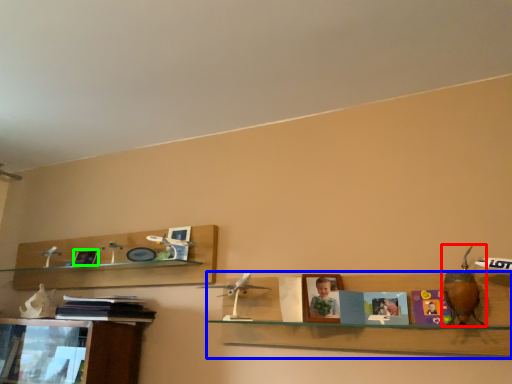
Question: Which is farther away from toy (highlighted by a red box)? shelf (highlighted by a blue box) or picture frame (highlighted by a green box)?

Choices:
 (A) shelf
 (B) picture frame

Answer: (B)